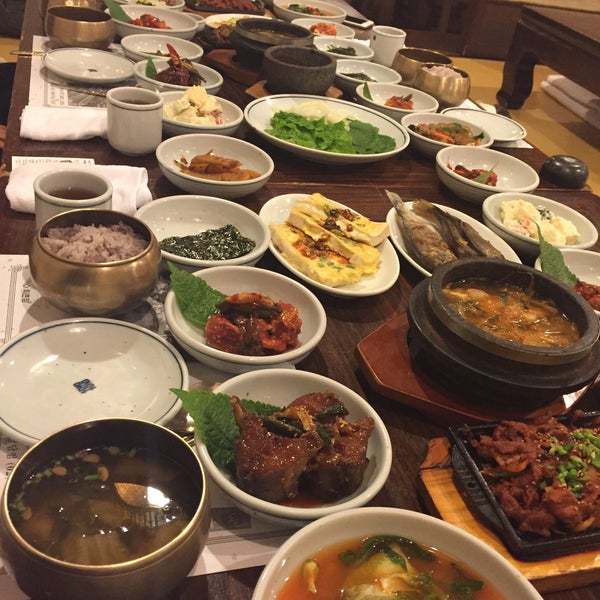
The image size is (600, 600). I want to click on plate, so click(x=120, y=382).